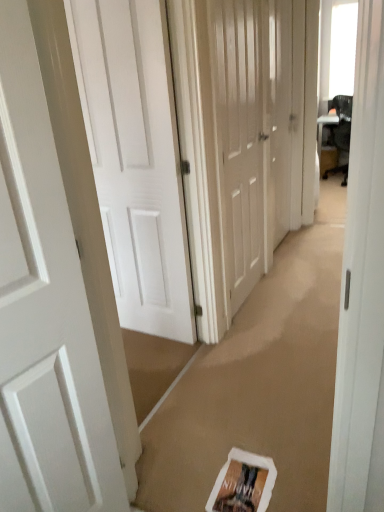
Question: Does white matte door at center, placed as the second door when sorted from right to left, come in front of white matte door at center, arranged as the 2th door when viewed from the left?

Choices:
 (A) no
 (B) yes

Answer: (A)

Question: Can you confirm if white matte door at center, placed as the second door when sorted from right to left, is thinner than white matte door at center, arranged as the 2th door when viewed from the left?

Choices:
 (A) no
 (B) yes

Answer: (B)

Question: Considering the relative sizes of white matte door at center, placed as the second door when sorted from right to left, and white matte door at center, arranged as the 2th door when viewed from the left, in the image provided, is white matte door at center, placed as the second door when sorted from right to left, shorter than white matte door at center, arranged as the 2th door when viewed from the left,?

Choices:
 (A) no
 (B) yes

Answer: (A)

Question: Can you confirm if white matte door at center, placed as the second door when sorted from right to left, is positioned to the right of white matte door at center, which is the 3th door in right-to-left order?

Choices:
 (A) no
 (B) yes

Answer: (B)

Question: From a real-world perspective, is white matte door at center, positioned as the 3th door in left-to-right order, physically below white matte door at center, arranged as the 2th door when viewed from the left?

Choices:
 (A) yes
 (B) no

Answer: (B)

Question: Is white matte door at center, positioned as the 3th door in left-to-right order, oriented away from white matte door at center, which is the 3th door in right-to-left order?

Choices:
 (A) no
 (B) yes

Answer: (A)

Question: From the image's perspective, is white matte door at left, the fourth door positioned from the right, located beneath white matte door at center, arranged as the 2th door when viewed from the left?

Choices:
 (A) yes
 (B) no

Answer: (A)

Question: Is white matte door at left, the fourth door positioned from the right, further to camera compared to white matte door at center, arranged as the 2th door when viewed from the left?

Choices:
 (A) no
 (B) yes

Answer: (A)

Question: Is white matte door at left, the fourth door positioned from the right, thinner than white matte door at center, which is the 3th door in right-to-left order?

Choices:
 (A) yes
 (B) no

Answer: (A)

Question: Is white matte door at center, arranged as the 2th door when viewed from the left, a part of white matte door at left, the fourth door positioned from the right?

Choices:
 (A) yes
 (B) no

Answer: (B)

Question: Is white matte door at left, the fourth door positioned from the right, to the left of white matte door at center, arranged as the 2th door when viewed from the left, from the viewer's perspective?

Choices:
 (A) yes
 (B) no

Answer: (A)

Question: Does white matte door at left, the fourth door positioned from the right, turn towards white matte door at center, arranged as the 2th door when viewed from the left?

Choices:
 (A) yes
 (B) no

Answer: (B)

Question: Does white matte door at center, arranged as the 2th door when viewed from the left, contain white matte door at center, placed as the second door when sorted from right to left?

Choices:
 (A) no
 (B) yes

Answer: (A)